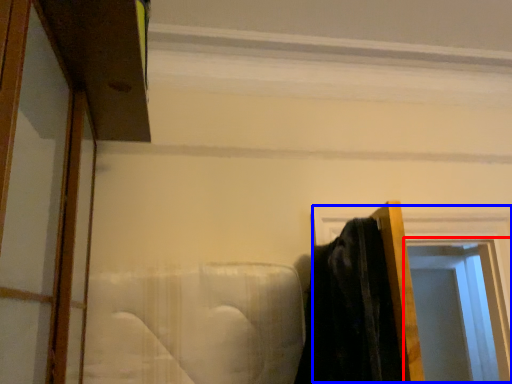
Question: Which point is further to the camera, window (highlighted by a red box) or window frame (highlighted by a blue box)?

Choices:
 (A) window
 (B) window frame

Answer: (A)